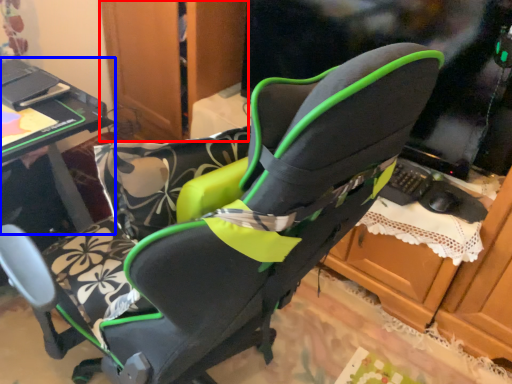
Question: Which object appears farthest to the camera in this image, dresser (highlighted by a red box) or table (highlighted by a blue box)?

Choices:
 (A) dresser
 (B) table

Answer: (A)